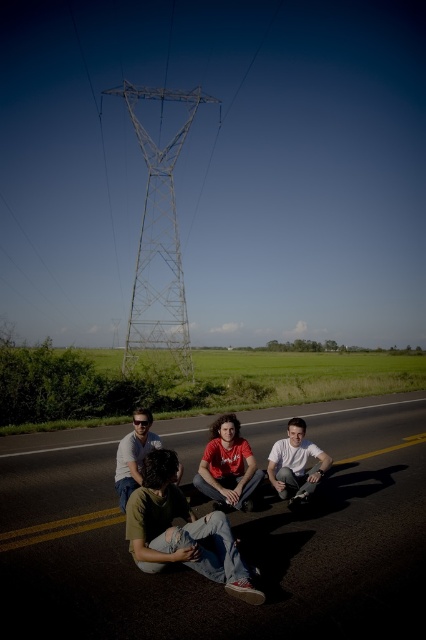
Question: Among these objects, which one is farthest from the camera?

Choices:
 (A) matte white shirt at lower left
 (B) matte red t-shirt at center

Answer: (B)

Question: Which of the following is the farthest from the observer?

Choices:
 (A) (101, 93)
 (B) (143, 408)
 (C) (305, 440)

Answer: (A)

Question: Estimate the real-world distances between objects in this image. Which object is closer to the black asphalt highway at center?

Choices:
 (A) green denim jeans at lower left
 (B) matte white shirt at lower left
 (C) matte red t-shirt at center
 (D) light gray smooth skateboard at center

Answer: (A)

Question: Observing the image, what is the correct spatial positioning of metallic silver tower at center in reference to light gray smooth skateboard at center?

Choices:
 (A) left
 (B) right

Answer: (A)

Question: Is metallic silver tower at center positioned in front of matte white shirt at lower left?

Choices:
 (A) no
 (B) yes

Answer: (A)

Question: Can you confirm if black asphalt highway at center is positioned to the right of matte red t-shirt at center?

Choices:
 (A) no
 (B) yes

Answer: (A)